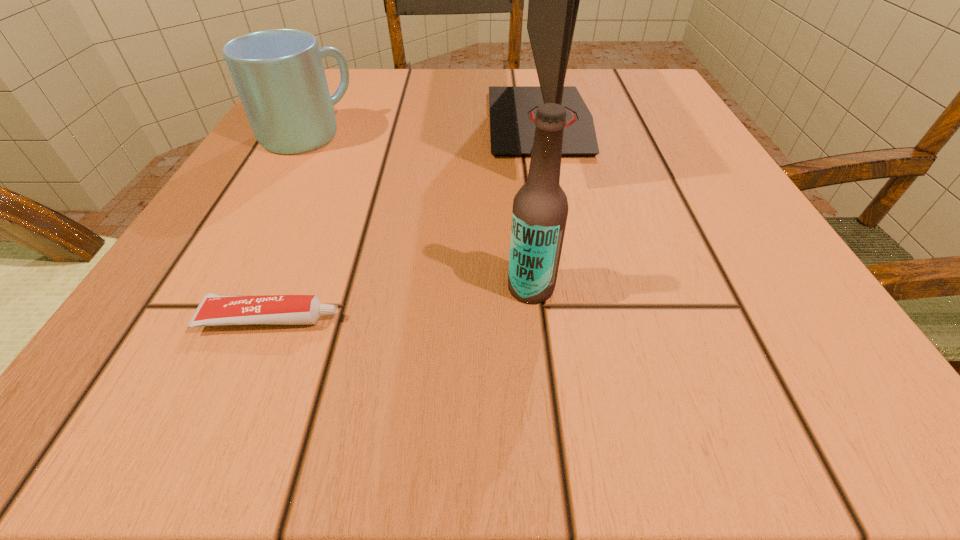
Identify the location of vacant area that lies between the third tallest object and the beer bottle. (419, 211).

Locate an element on the screen. This screenshot has width=960, height=540. vacant area between the beer bottle and the shortest object is located at coordinates (x=401, y=303).

Select which object appears as the third closest to the monitor. Please provide its 2D coordinates. Your answer should be formatted as a tuple, i.e. [(x, y)], where the tuple contains the x and y coordinates of a point satisfying the conditions above.

[(214, 309)]

Where is `object that is the second nearest to the monitor`? object that is the second nearest to the monitor is located at coordinates (279, 75).

Identify the location of free point that satisfies the following two spatial constraints: 1. on the screen side of the tallest object; 2. on the front side of the second shortest object. (543, 135).